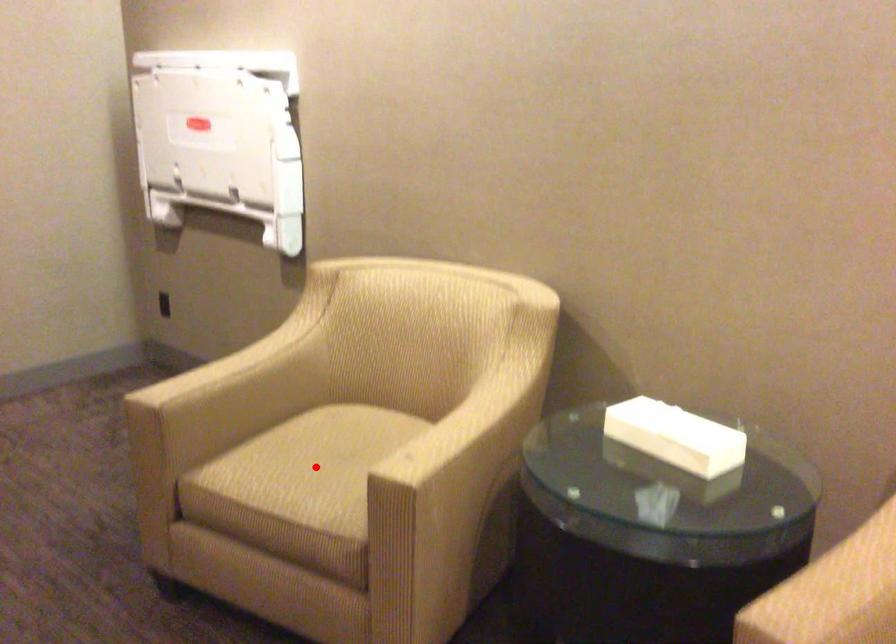
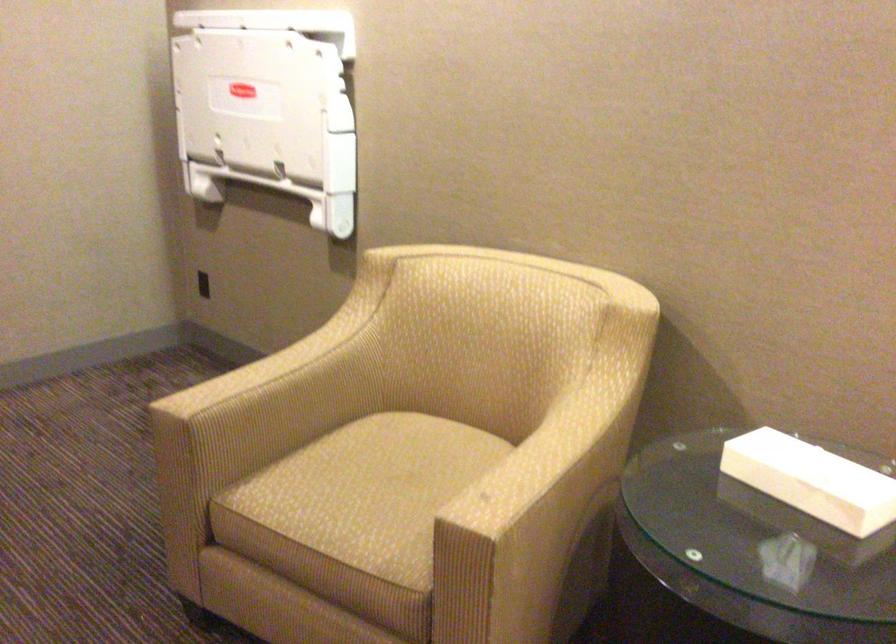
Locate, in the second image, the point that corresponds to the highlighted location in the first image.

(371, 491)